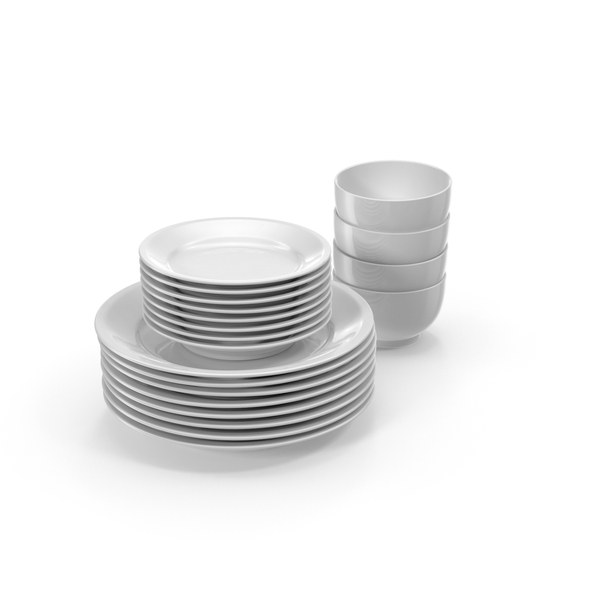
Locate an element on the screen. The image size is (600, 600). bowls is located at coordinates (400, 208), (400, 243), (412, 276), (404, 311).